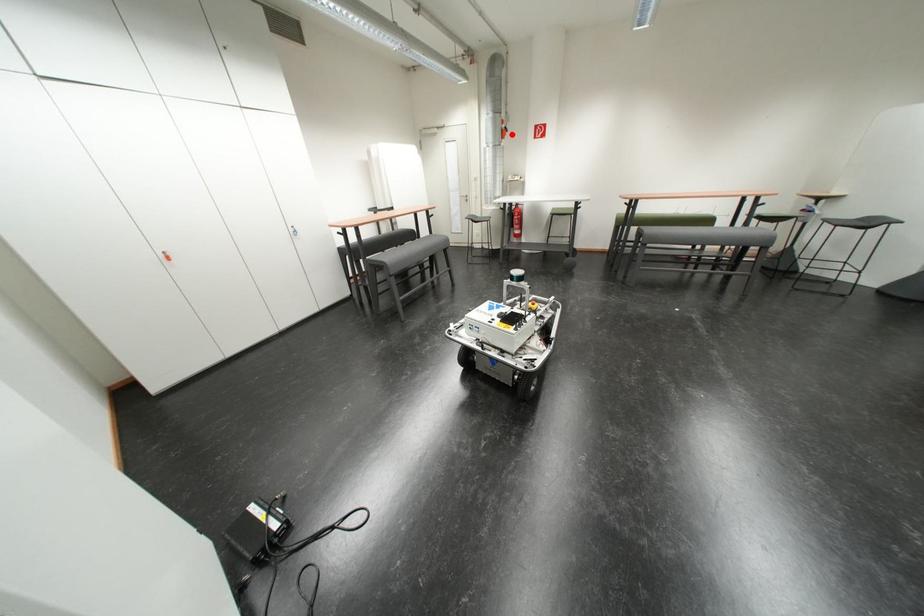
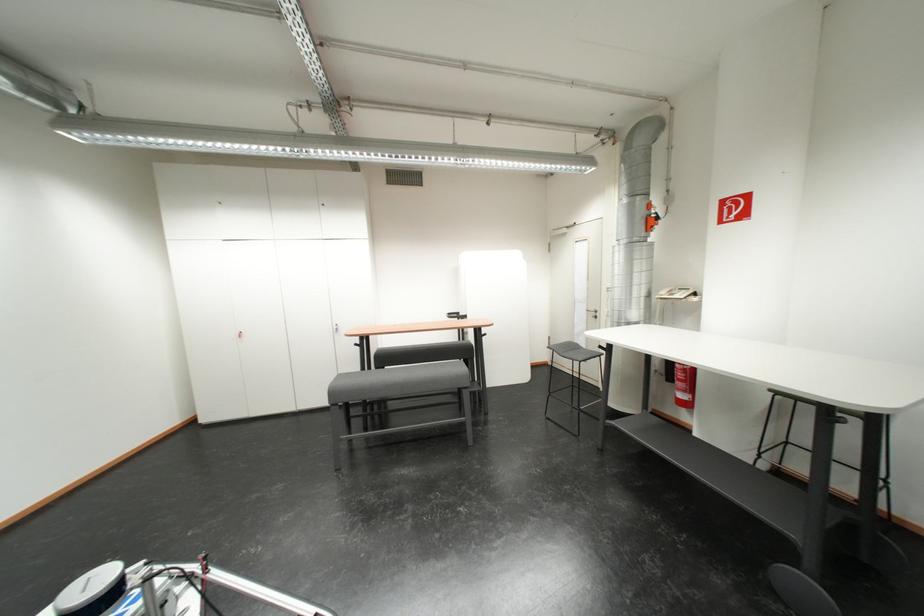
Where in the second image is the point corresponding to the highlighted location from the first image?

(654, 224)